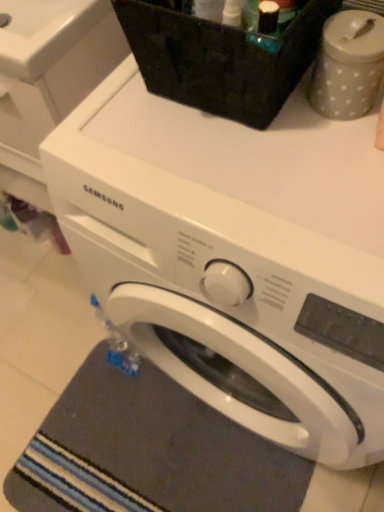
Question: Does point (29, 17) appear closer or farther from the camera than point (311, 94)?

Choices:
 (A) farther
 (B) closer

Answer: (A)

Question: Considering the relative positions of white glossy sink at upper left and gray dotted container at upper right in the image provided, is white glossy sink at upper left to the left or to the right of gray dotted container at upper right?

Choices:
 (A) left
 (B) right

Answer: (A)

Question: Which of these objects is positioned farthest from the white glossy sink at upper left?

Choices:
 (A) white matte washing machine at upper center, which is counted as the second washing machine, starting from the right
 (B) dark gray textured bath mat at lower left
 (C) white glossy washing machine at center, which is the 2th washing machine from left to right
 (D) gray dotted container at upper right

Answer: (B)

Question: Estimate the real-world distances between objects in this image. Which object is closer to the gray dotted container at upper right?

Choices:
 (A) dark gray textured bath mat at lower left
 (B) white matte washing machine at upper center, which appears as the 1th washing machine when viewed from the left
 (C) white glossy sink at upper left
 (D) white glossy washing machine at center, placed as the first washing machine when sorted from right to left

Answer: (D)